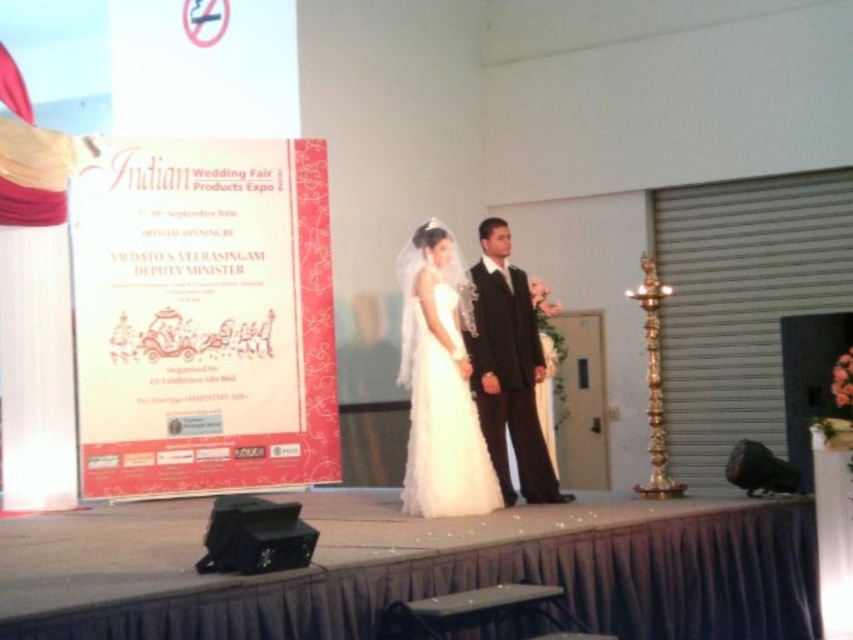
Question: Which point is closer to the camera?

Choices:
 (A) (438, 440)
 (B) (491, 371)

Answer: (A)

Question: Does white satin dress at center have a larger size compared to black satin suit at center?

Choices:
 (A) yes
 (B) no

Answer: (B)

Question: Which point is closer to the camera?

Choices:
 (A) (440, 358)
 (B) (486, 232)

Answer: (A)

Question: Is white satin dress at center smaller than black satin suit at center?

Choices:
 (A) no
 (B) yes

Answer: (B)

Question: Does white satin dress at center appear on the right side of black satin suit at center?

Choices:
 (A) yes
 (B) no

Answer: (B)